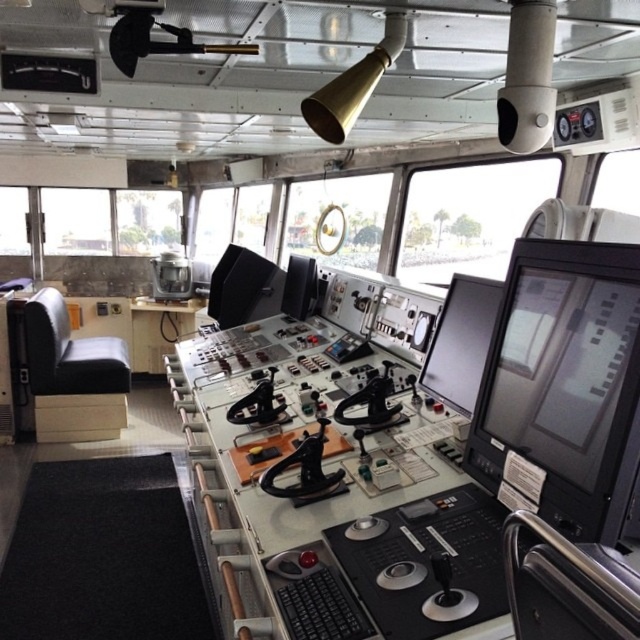
You are a ship navigator who needs to locate the black glossy monitor at center right on the ship bridge. Based on the coordinates provided, where would you find it relative to the central console?

The black glossy monitor at center right is located at coordinates point [563,387] relative to the central console.

You are a crew member on the ship and need to reach the black glossy monitor at center to adjust its settings. Your arm can extend 5 feet. Can you reach it without moving from your current position?

The black glossy monitor at center is 5.94 feet away from the viewer. Since your arm can only extend 5 feet, you cannot reach it without moving closer.